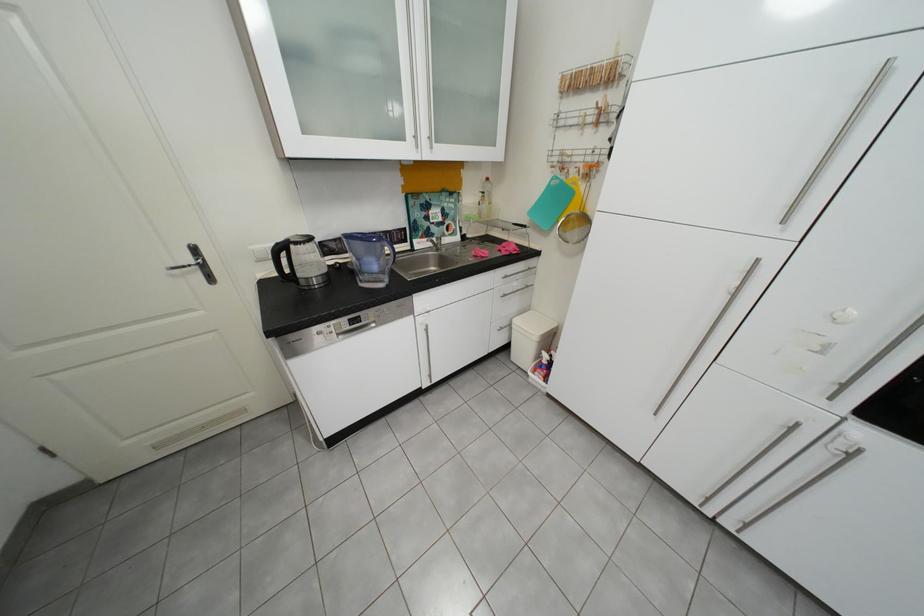
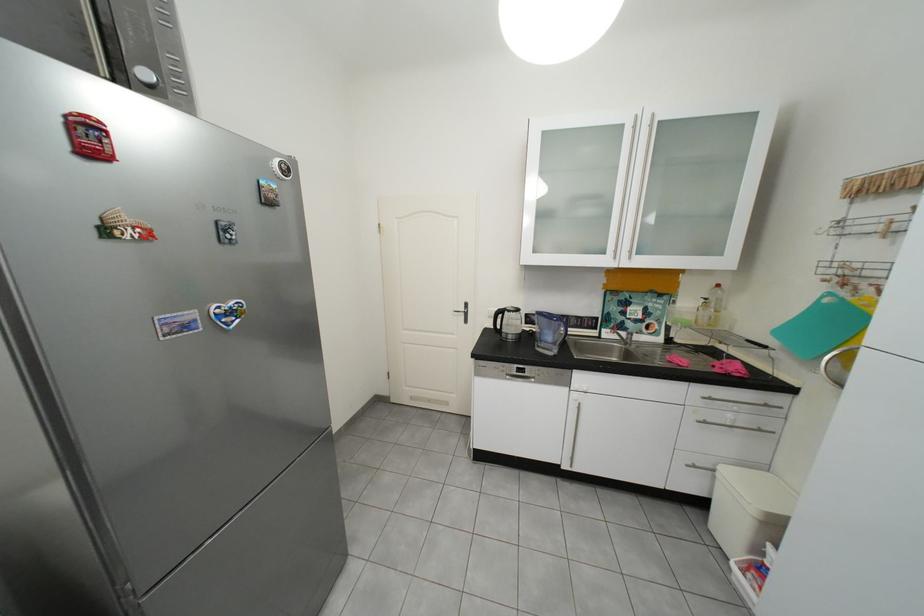
Where in the second image is the point corresponding to the point at 514,330 from the first image?

(707, 468)